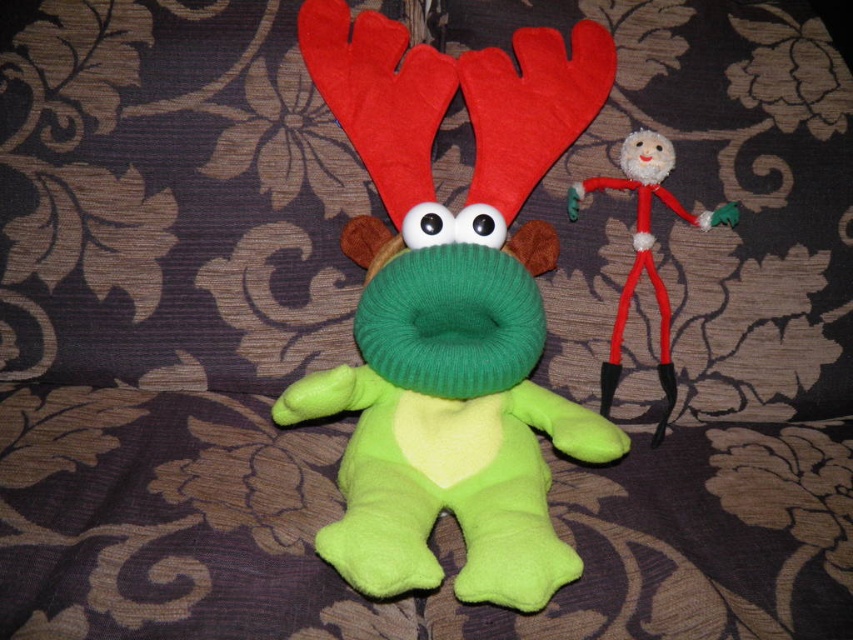
Between green soft plush toy at center and fuzzy red stick figure at upper right, which one is positioned lower?

green soft plush toy at center

Can you confirm if green soft plush toy at center is smaller than fuzzy red stick figure at upper right?

Actually, green soft plush toy at center might be larger than fuzzy red stick figure at upper right.

At what (x,y) coordinates should I click in order to perform the action: click on green soft plush toy at center. Please return your answer as a coordinate pair (x, y). The width and height of the screenshot is (853, 640). Looking at the image, I should click on (450, 308).

In order to click on green soft plush toy at center in this screenshot , I will do `click(450, 308)`.